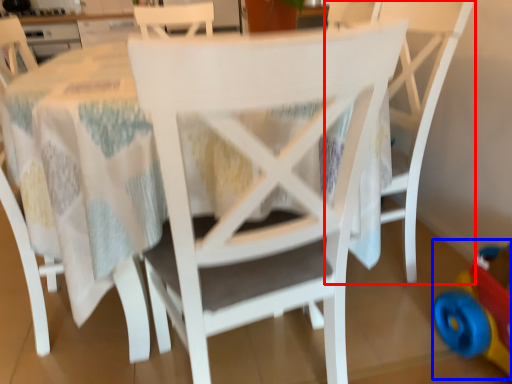
Question: Which of the following is the closest to the observer, chair (highlighted by a red box) or toy (highlighted by a blue box)?

Choices:
 (A) chair
 (B) toy

Answer: (B)